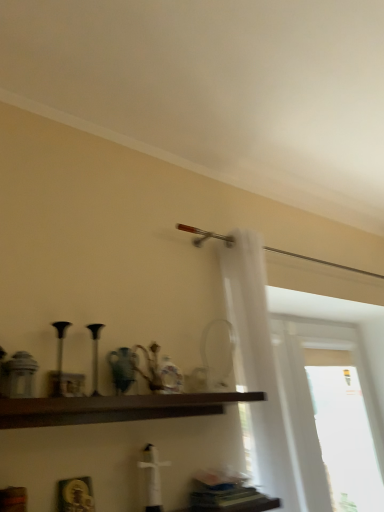
Find the location of a particular element. The height and width of the screenshot is (512, 384). transparent glass window at right is located at coordinates (329, 415).

Can you confirm if dark brown wood shelf at center is positioned to the right of white sheer curtain at right?

In fact, dark brown wood shelf at center is to the left of white sheer curtain at right.

Which of these two, dark brown wood shelf at center or white sheer curtain at right, stands shorter?

Standing shorter between the two is dark brown wood shelf at center.

From a real-world perspective, who is located lower, dark brown wood shelf at center or white sheer curtain at right?

dark brown wood shelf at center, from a real-world perspective.

Does dark brown wood shelf at center have a greater width compared to white sheer curtain at right?

No, dark brown wood shelf at center is not wider than white sheer curtain at right.

Is transparent glass window at right in front of or behind dark brown wood shelf at center in the image?

transparent glass window at right is positioned farther from the viewer than dark brown wood shelf at center.

Looking at this image, would you say transparent glass window at right is inside or outside dark brown wood shelf at center?

transparent glass window at right exists outside the volume of dark brown wood shelf at center.

Is transparent glass window at right turned away from dark brown wood shelf at center?

No, transparent glass window at right's orientation is not away from dark brown wood shelf at center.

Which of these two, transparent glass window at right or dark brown wood shelf at center, is smaller?

With smaller size is dark brown wood shelf at center.

This screenshot has width=384, height=512. In the image, there is a transparent glass window at right. In order to click on shower curtain above it (from the image's perspective) in this screenshot , I will do `click(259, 368)`.

Is white sheer curtain at right not close to transparent glass window at right?

white sheer curtain at right is positioned a significant distance from transparent glass window at right.

Is transparent glass window at right at the back of white sheer curtain at right?

No, white sheer curtain at right's orientation is not away from transparent glass window at right.

Who is more distant, transparent glass window at right or white sheer curtain at right?

transparent glass window at right is further from the camera.

Which is more to the left, transparent glass window at right or white sheer curtain at right?

white sheer curtain at right.

Is transparent glass window at right facing towards white sheer curtain at right?

No, transparent glass window at right is not aimed at white sheer curtain at right.

In the scene shown: Can you tell me how much transparent glass window at right and white sheer curtain at right differ in facing direction?

There is a 2.97-degree angle between the facing directions of transparent glass window at right and white sheer curtain at right.

Does white sheer curtain at right appear on the left side of dark brown wood shelf at center?

No.

Where is `shelf below the white sheer curtain at right (from the image's perspective)`? shelf below the white sheer curtain at right (from the image's perspective) is located at coordinates click(115, 408).

Is white sheer curtain at right situated inside dark brown wood shelf at center or outside?

white sheer curtain at right is not enclosed by dark brown wood shelf at center.

Considering the sizes of white sheer curtain at right and dark brown wood shelf at center in the image, is white sheer curtain at right bigger or smaller than dark brown wood shelf at center?

white sheer curtain at right is bigger than dark brown wood shelf at center.

Which object is closer to the camera taking this photo, dark brown wood shelf at center or transparent glass window at right?

dark brown wood shelf at center is closer to the camera.

From the image's perspective, between dark brown wood shelf at center and transparent glass window at right, who is located below?

From the image's view, transparent glass window at right is below.

How far apart are dark brown wood shelf at center and transparent glass window at right?

A distance of 4.49 feet exists between dark brown wood shelf at center and transparent glass window at right.

In the scene shown: Is dark brown wood shelf at center facing away from transparent glass window at right?

No, dark brown wood shelf at center is not facing the opposite direction of transparent glass window at right.

You are a GUI agent. You are given a task and a screenshot of the screen. Output one action in this format:
    pyautogui.click(x=<x>, y=<y>)
    Task: Click on the shower curtain above the dark brown wood shelf at center (from a real-world perspective)
    The width and height of the screenshot is (384, 512).
    Given the screenshot: What is the action you would take?
    pyautogui.click(x=259, y=368)

The height and width of the screenshot is (512, 384). I want to click on window lying below the dark brown wood shelf at center (from the image's perspective), so click(x=329, y=415).

Estimate the real-world distances between objects in this image. Which object is further from white sheer curtain at right, dark brown wood shelf at center or transparent glass window at right?

The object further to white sheer curtain at right is transparent glass window at right.

Which object lies nearer to the anchor point transparent glass window at right, white sheer curtain at right or dark brown wood shelf at center?

white sheer curtain at right lies closer to transparent glass window at right than the other object.

Considering their positions, is transparent glass window at right positioned further to dark brown wood shelf at center than white sheer curtain at right?

transparent glass window at right is further to dark brown wood shelf at center.

Based on their spatial positions, is dark brown wood shelf at center or white sheer curtain at right closer to transparent glass window at right?

white sheer curtain at right is closer to transparent glass window at right.

Looking at the image, which one is located further to white sheer curtain at right, transparent glass window at right or dark brown wood shelf at center?

transparent glass window at right is positioned further to the anchor white sheer curtain at right.

From the image, which object appears to be nearer to dark brown wood shelf at center, white sheer curtain at right or transparent glass window at right?

white sheer curtain at right lies closer to dark brown wood shelf at center than the other object.

This screenshot has width=384, height=512. What are the coordinates of `shower curtain between dark brown wood shelf at center and transparent glass window at right from front to back` in the screenshot? It's located at (259, 368).